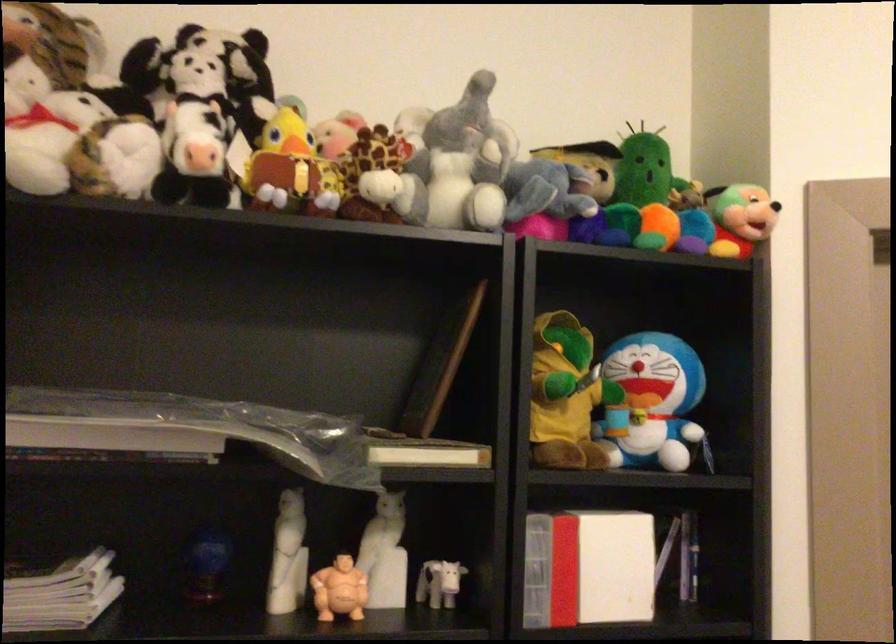
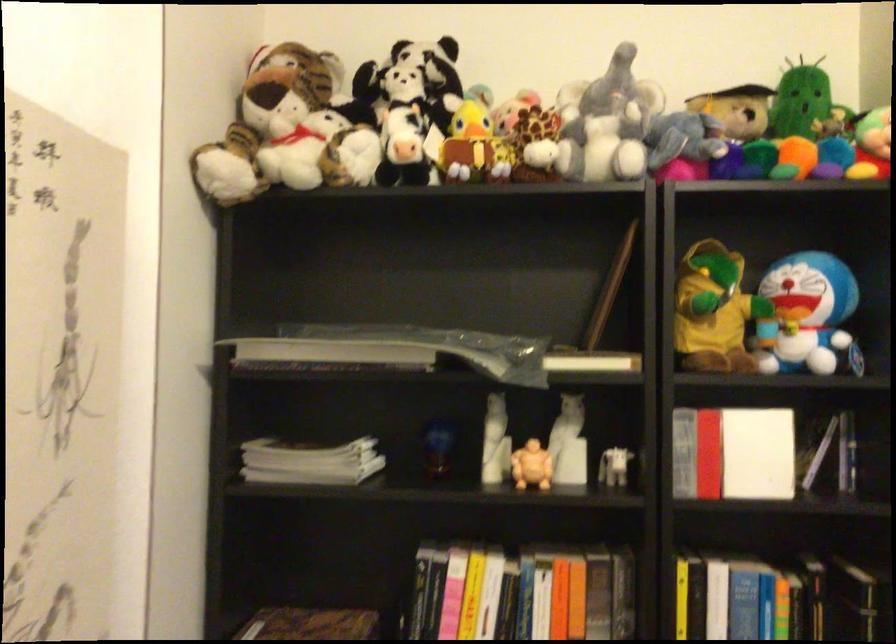
Find the pixel in the second image that matches pixel 643 166 in the first image.

(799, 100)